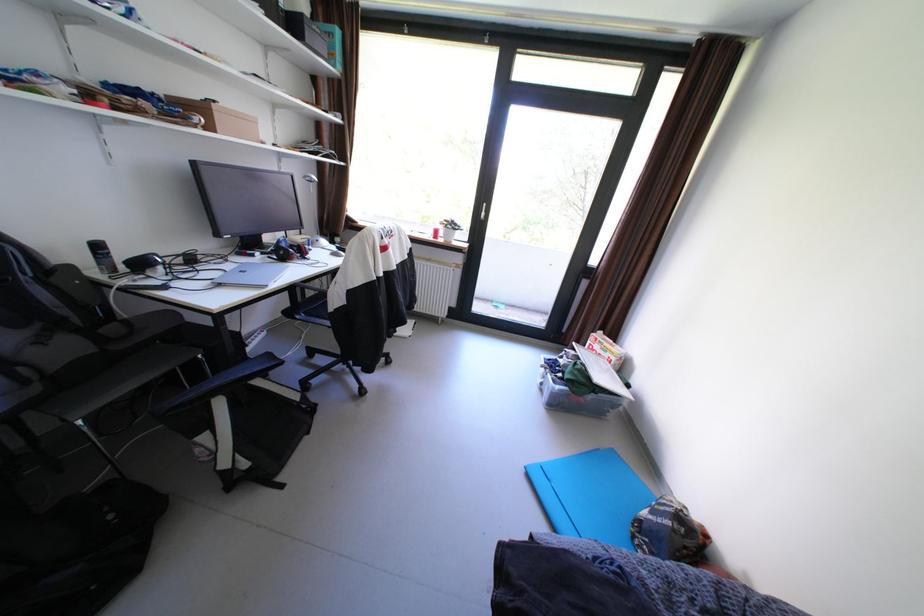
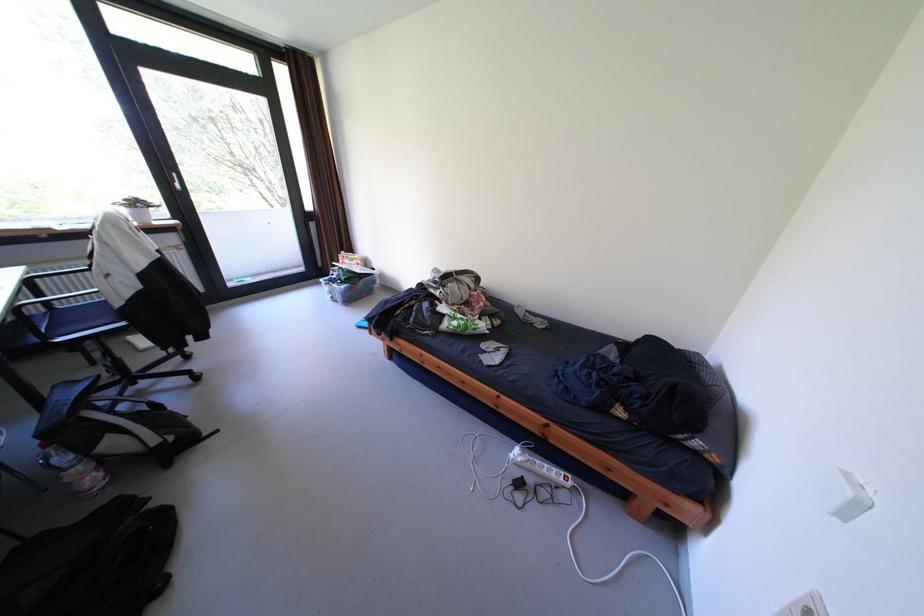
In the second image, find the point that corresponds to point (463, 225) in the first image.

(149, 205)